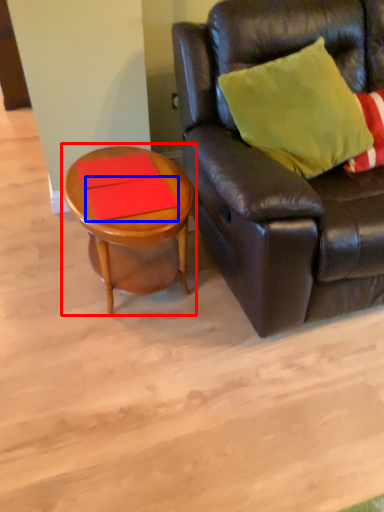
Question: Which object appears farthest to the camera in this image, coffee table (highlighted by a red box) or plank (highlighted by a blue box)?

Choices:
 (A) coffee table
 (B) plank

Answer: (B)